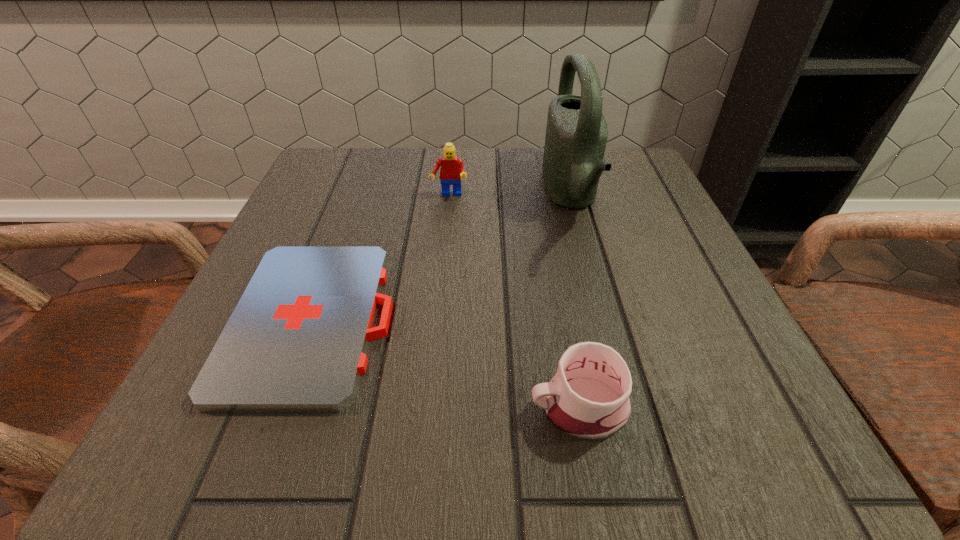
Image resolution: width=960 pixels, height=540 pixels. Find the location of `vacant space situated 0.050m on the side with the handle of the third tallest object`. vacant space situated 0.050m on the side with the handle of the third tallest object is located at coordinates (491, 407).

You are a GUI agent. You are given a task and a screenshot of the screen. Output one action in this format:
    pyautogui.click(x=<x>, y=<y>)
    Task: Click on the vacant space located 0.270m on the side with the handle of the third tallest object
    The height and width of the screenshot is (540, 960).
    Given the screenshot: What is the action you would take?
    (x=316, y=407)

Where is `vacant point located on the side with the handle of the third tallest object`? This screenshot has height=540, width=960. vacant point located on the side with the handle of the third tallest object is located at coordinates (396, 407).

Locate an element on the screen. The image size is (960, 540). vacant space located 0.200m on handle side the leftmost object is located at coordinates (523, 320).

What are the coordinates of `watering can that is at the far edge` in the screenshot? It's located at (576, 134).

The image size is (960, 540). I want to click on Lego that is at the far edge, so click(452, 171).

This screenshot has width=960, height=540. Find the location of `mug situated at the near edge`. mug situated at the near edge is located at coordinates (588, 398).

Find the location of `the first-aid kit situated at the near edge`. the first-aid kit situated at the near edge is located at coordinates (296, 341).

Where is `object located in the left edge section of the desktop`? This screenshot has width=960, height=540. object located in the left edge section of the desktop is located at coordinates (296, 341).

The width and height of the screenshot is (960, 540). I want to click on object located in the right edge section of the desktop, so click(576, 134).